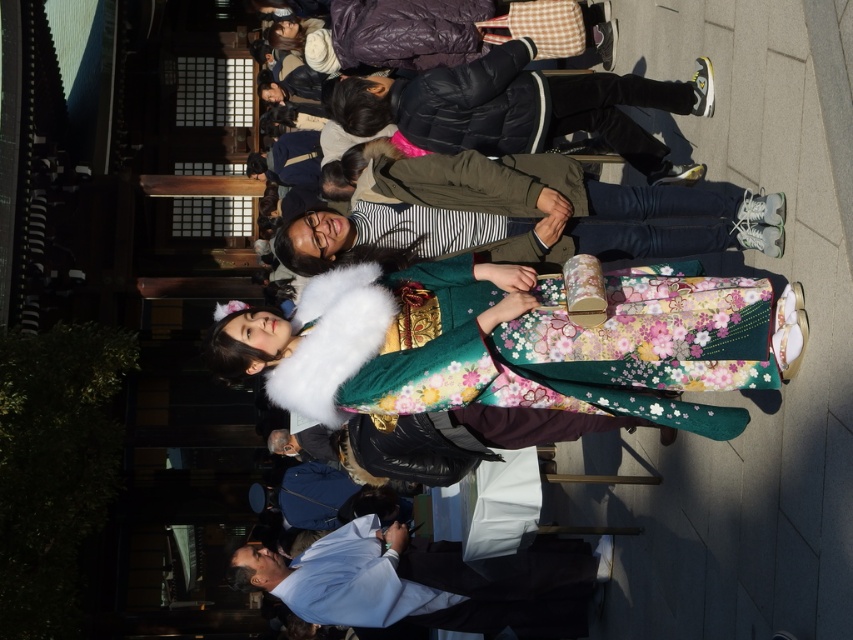
You are taking a photo of two people standing in the center of a Japanese garden. The subjects are wearing a floral silk kimono at center and a striped fabric shirt at center. Based on their positioning, which clothing item is more to the left?

The floral silk kimono at center is positioned on the left side of the striped fabric shirt at center, so it is more to the left.

Consider the image. You are a photographer who wants to capture both the floral silk kimono at center and the fluffy white kimono at center in the same frame. Since you want to highlight their different lengths, where should you position the camera relative to the models to best emphasize this difference?

To emphasize the difference in length between the floral silk kimono at center and the fluffy white kimono at center, position the camera at a low angle so that the longer fluffy white kimono at center appears even more extended compared to the shorter floral silk kimono at center.